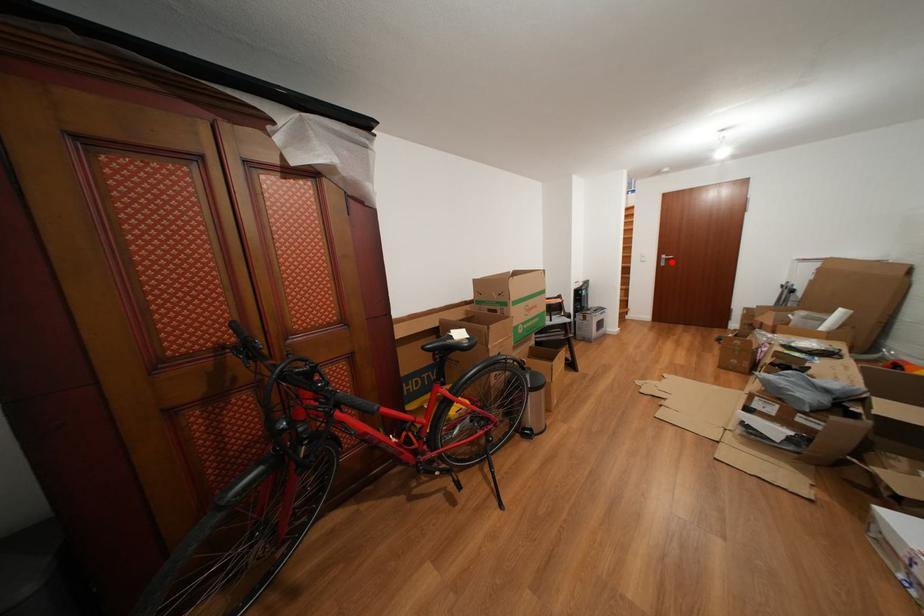
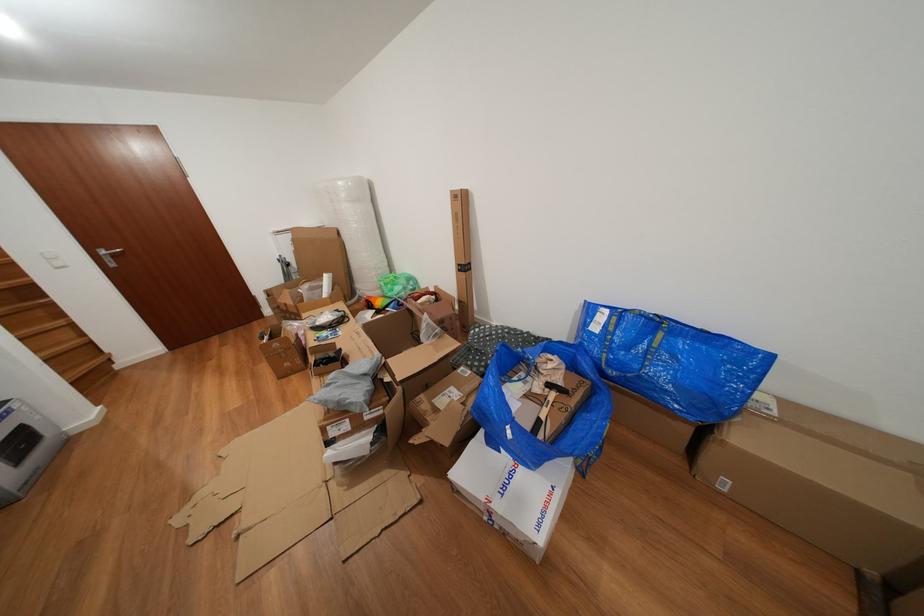
Locate, in the second image, the point that corresponds to the highlighted location in the first image.

(112, 257)